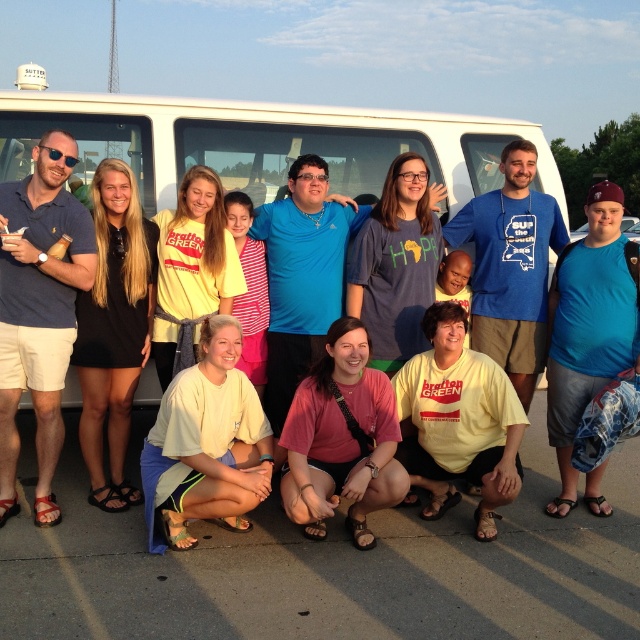
Question: Is yellow cotton shirt at lower center in front of blue t-shirt at center?

Choices:
 (A) no
 (B) yes

Answer: (B)

Question: Which of the following is the farthest from the observer?

Choices:
 (A) (x=122, y=456)
 (B) (x=320, y=132)
 (C) (x=198, y=474)

Answer: (B)

Question: Which of the following is the closest to the observer?

Choices:
 (A) (92, 438)
 (B) (522, 122)
 (C) (308, 532)
 (D) (192, 480)

Answer: (D)

Question: Can you confirm if yellow cotton shirt at lower center is positioned above black dress at left?

Choices:
 (A) no
 (B) yes

Answer: (A)

Question: Can you confirm if yellow cotton shirt at lower center is positioned above black dress at left?

Choices:
 (A) yes
 (B) no

Answer: (B)

Question: Which point appears closest to the camera in this image?

Choices:
 (A) (108, 154)
 (B) (364, 435)

Answer: (B)